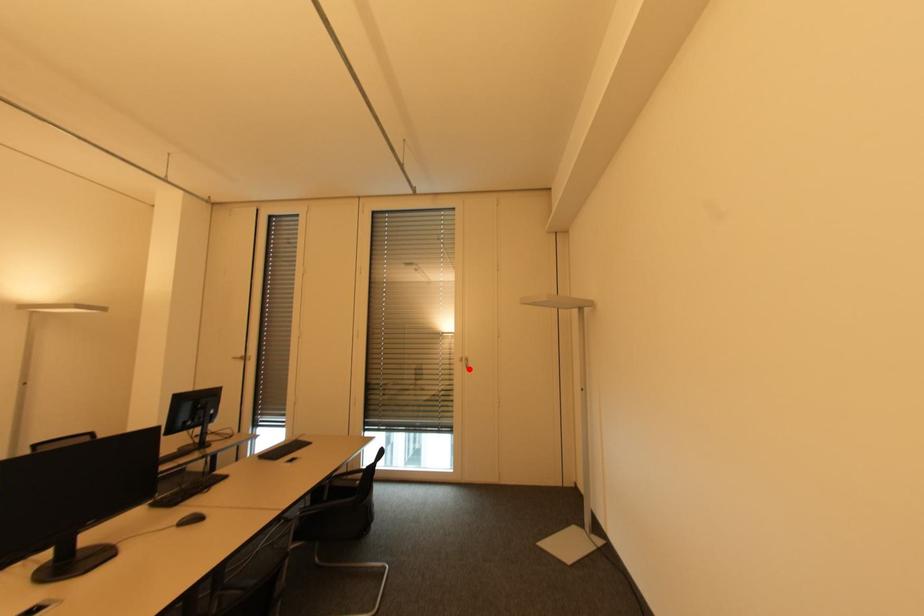
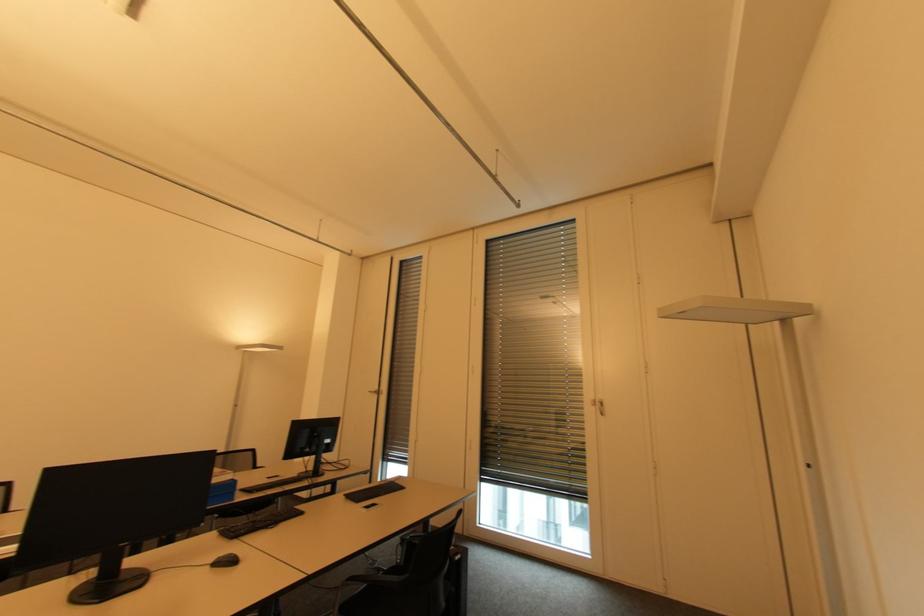
In the second image, find the point that corresponds to the highlighted location in the first image.

(603, 416)